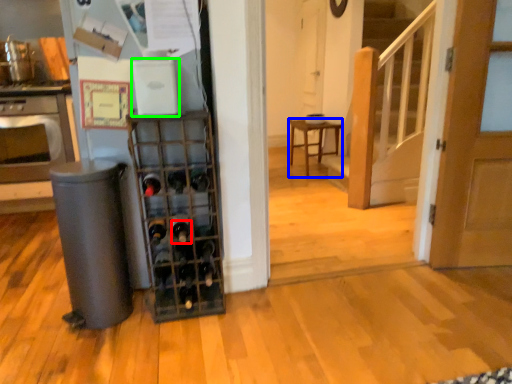
Question: Which object is the closest to the wine bottle (highlighted by a red box)? Choose among these: furniture (highlighted by a blue box) or appliance (highlighted by a green box).

Choices:
 (A) furniture
 (B) appliance

Answer: (B)